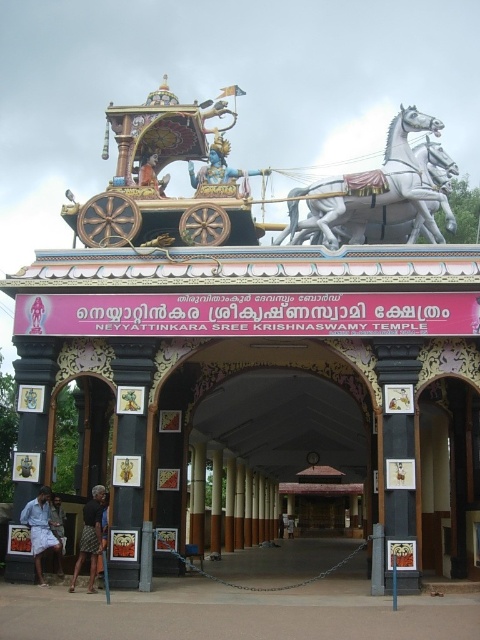
Who is more distant from viewer, (344, 202) or (59, 573)?

Positioned behind is point (344, 202).

Based on the photo, between white glossy horse at upper center and dark gray fabric skirt at lower left, which one is positioned higher?

Positioned higher is white glossy horse at upper center.

Describe the element at coordinates (381, 211) in the screenshot. I see `white glossy horse at upper center` at that location.

The height and width of the screenshot is (640, 480). Find the location of `white glossy horse at upper center`. white glossy horse at upper center is located at coordinates (381, 211).

Looking at this image, is white glossy horse at upper center to the right of dark brown woven skirt at lower left from the viewer's perspective?

Indeed, white glossy horse at upper center is positioned on the right side of dark brown woven skirt at lower left.

Is point (364, 208) positioned behind point (82, 552)?

Yes, it is behind point (82, 552).

What do you see at coordinates (381, 211) in the screenshot? I see `white glossy horse at upper center` at bounding box center [381, 211].

This screenshot has width=480, height=640. Find the location of `white glossy horse at upper center`. white glossy horse at upper center is located at coordinates (381, 211).

Is light blue cotton shirt at lower left below dark gray fabric skirt at lower left?

Yes, light blue cotton shirt at lower left is below dark gray fabric skirt at lower left.

Does light blue cotton shirt at lower left lie behind dark gray fabric skirt at lower left?

No, it is in front of dark gray fabric skirt at lower left.

Between point (39, 531) and point (61, 524), which one is positioned in front?

Point (39, 531)

What are the coordinates of `light blue cotton shirt at lower left` in the screenshot? It's located at (40, 531).